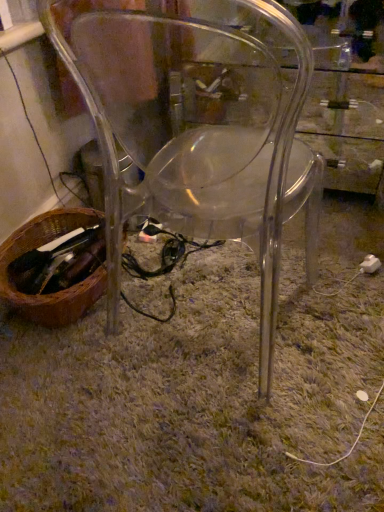
Question: Is green shaggy carpet at center surrounded by brown woven basket at lower left?

Choices:
 (A) yes
 (B) no

Answer: (B)

Question: Considering the relative sizes of brown woven basket at lower left and green shaggy carpet at center in the image provided, is brown woven basket at lower left wider than green shaggy carpet at center?

Choices:
 (A) no
 (B) yes

Answer: (A)

Question: Is brown woven basket at lower left oriented away from green shaggy carpet at center?

Choices:
 (A) yes
 (B) no

Answer: (B)

Question: From a real-world perspective, is brown woven basket at lower left over green shaggy carpet at center?

Choices:
 (A) no
 (B) yes

Answer: (B)

Question: Considering the relative sizes of brown woven basket at lower left and green shaggy carpet at center in the image provided, is brown woven basket at lower left bigger than green shaggy carpet at center?

Choices:
 (A) yes
 (B) no

Answer: (B)

Question: Is brown woven basket at lower left not inside green shaggy carpet at center?

Choices:
 (A) yes
 (B) no

Answer: (A)

Question: Is transparent plastic chair at center far from brown woven basket at lower left?

Choices:
 (A) yes
 (B) no

Answer: (B)

Question: Does transparent plastic chair at center have a lesser height compared to brown woven basket at lower left?

Choices:
 (A) no
 (B) yes

Answer: (A)

Question: Is transparent plastic chair at center turned away from brown woven basket at lower left?

Choices:
 (A) yes
 (B) no

Answer: (B)

Question: From a real-world perspective, is transparent plastic chair at center located higher than brown woven basket at lower left?

Choices:
 (A) no
 (B) yes

Answer: (B)

Question: Is the depth of transparent plastic chair at center less than that of brown woven basket at lower left?

Choices:
 (A) yes
 (B) no

Answer: (A)

Question: Is transparent plastic chair at center further to camera compared to brown woven basket at lower left?

Choices:
 (A) no
 (B) yes

Answer: (A)

Question: Can you confirm if white plastic plug at lower right is smaller than green shaggy carpet at center?

Choices:
 (A) no
 (B) yes

Answer: (B)